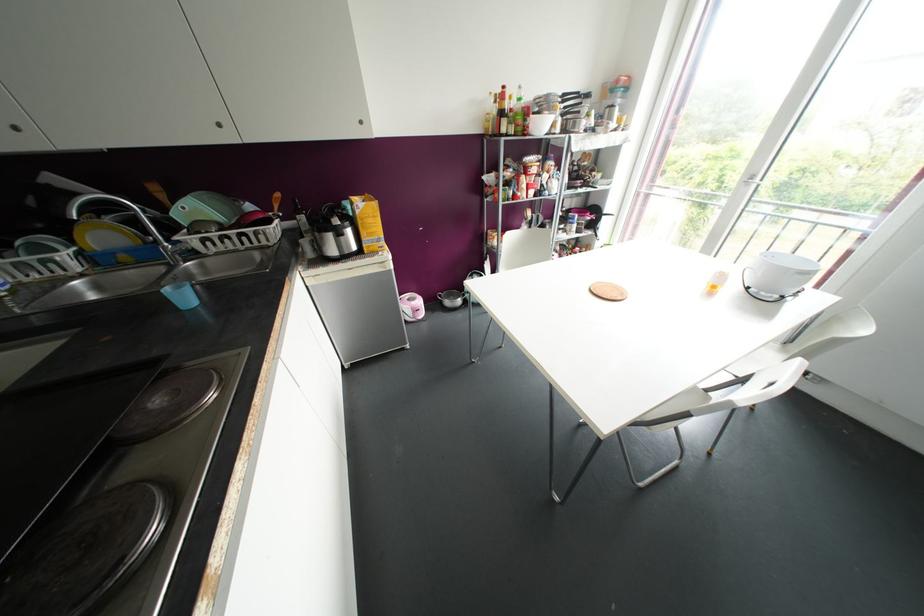
The width and height of the screenshot is (924, 616). Identify the location of silver door handle. (752, 180).